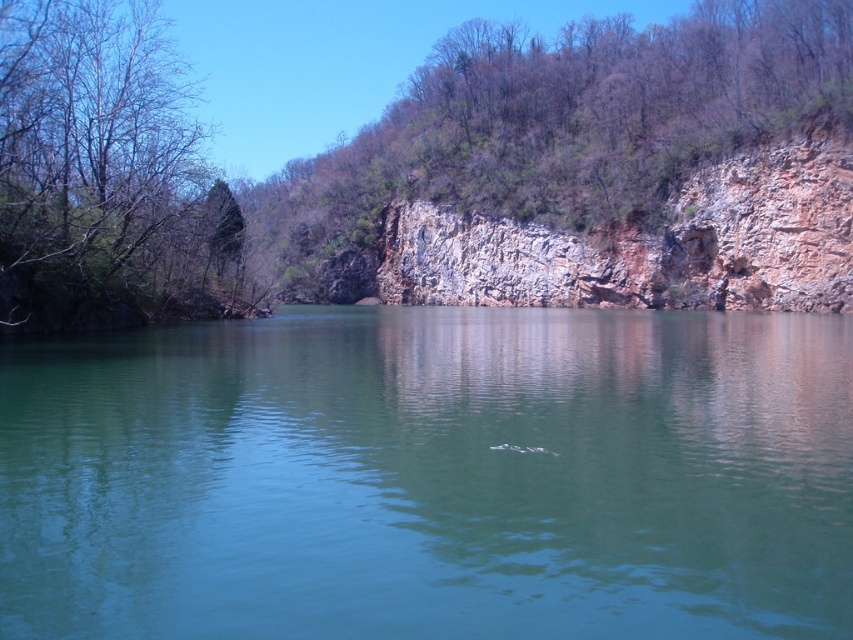
Question: Which of the following is the farthest from the observer?

Choices:
 (A) (386, 424)
 (B) (231, 198)
 (C) (839, 173)

Answer: (B)

Question: Which of the following is the farthest from the observer?

Choices:
 (A) green leafy tree at left
 (B) green smooth water at center

Answer: (A)

Question: Which object appears closest to the camera in this image?

Choices:
 (A) green smooth water at center
 (B) green leafy tree at left

Answer: (A)

Question: Is green leafy tree at left to the left of rocky cliff at right from the viewer's perspective?

Choices:
 (A) no
 (B) yes

Answer: (B)

Question: Can you confirm if green smooth water at center is positioned below green leafy tree at left?

Choices:
 (A) yes
 (B) no

Answer: (A)

Question: Is green smooth water at center positioned before green leafy tree at left?

Choices:
 (A) yes
 (B) no

Answer: (A)